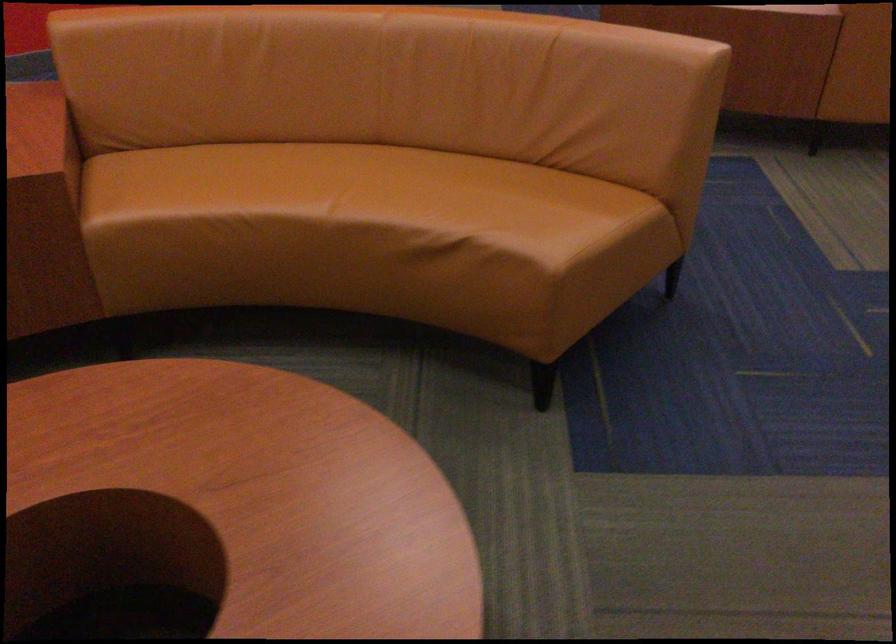
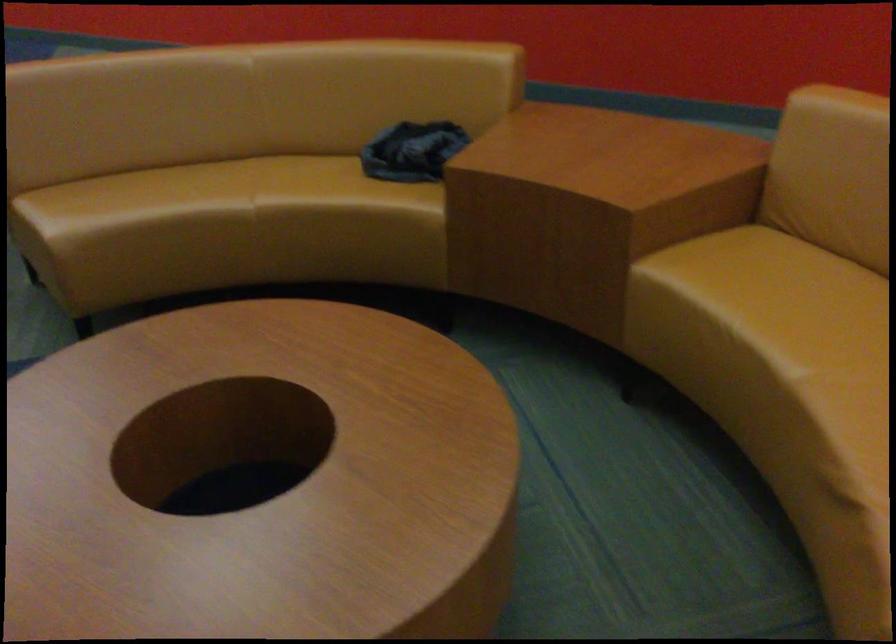
Based on the continuous images, in which direction is the camera rotating?

The rotation direction of the camera is left-down.